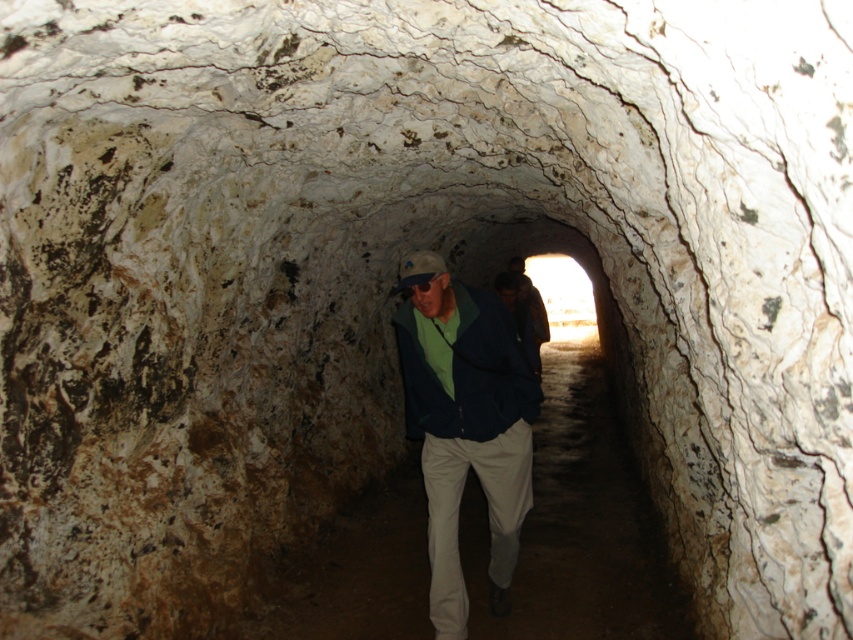
Question: Does matte blue jacket at center have a larger size compared to dark brown leather jacket at center?

Choices:
 (A) yes
 (B) no

Answer: (B)

Question: Does smooth stone path at center appear on the left side of matte green jacket at center?

Choices:
 (A) yes
 (B) no

Answer: (B)

Question: Which object appears closest to the camera in this image?

Choices:
 (A) smooth stone path at center
 (B) dark brown leather jacket at center
 (C) matte green jacket at center
 (D) matte blue jacket at center

Answer: (C)

Question: Based on their relative distances, which object is farther from the smooth stone path at center?

Choices:
 (A) matte blue jacket at center
 (B) matte green jacket at center

Answer: (A)

Question: Among these points, which one is nearest to the camera?

Choices:
 (A) (521, 280)
 (B) (415, 348)
 (C) (445, 273)
 (D) (688, 611)

Answer: (C)

Question: Does matte blue jacket at center appear on the right side of dark brown leather jacket at center?

Choices:
 (A) no
 (B) yes

Answer: (A)